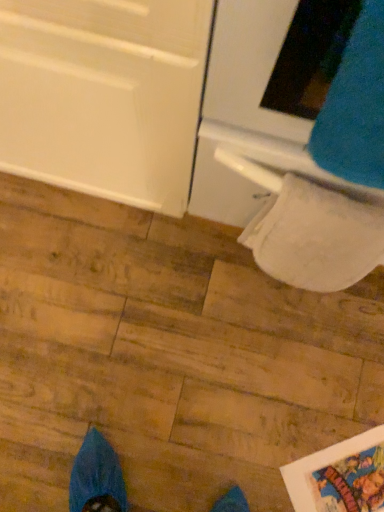
At what (x,y) coordinates should I click in order to perform the action: click on white glossy oven at upper right. Please return your answer as a coordinate pair (x, y). This screenshot has width=384, height=512. Looking at the image, I should click on (295, 151).

The image size is (384, 512). Describe the element at coordinates (315, 237) in the screenshot. I see `white textured toilet paper at lower right` at that location.

You are a GUI agent. You are given a task and a screenshot of the screen. Output one action in this format:
    pyautogui.click(x=<x>, y=<y>)
    Task: Click on the white glossy oven at upper right
    This screenshot has height=512, width=384.
    Given the screenshot: What is the action you would take?
    pyautogui.click(x=295, y=151)

Considering the positions of objects white glossy oven at upper right and blue fuzzy sweat pants at upper right in the image provided, who is in front, white glossy oven at upper right or blue fuzzy sweat pants at upper right?

blue fuzzy sweat pants at upper right.

What's the angular difference between white glossy oven at upper right and blue fuzzy sweat pants at upper right's facing directions?

3.48 degrees.

Which is more to the left, white glossy oven at upper right or blue fuzzy sweat pants at upper right?

Positioned to the left is blue fuzzy sweat pants at upper right.

In the image, is white glossy oven at upper right positioned in front of or behind white textured toilet paper at lower right?

white glossy oven at upper right is positioned closer to the viewer than white textured toilet paper at lower right.

In order to click on toilet paper behind the white glossy oven at upper right in this screenshot , I will do `click(315, 237)`.

Which of these two, white glossy oven at upper right or white textured toilet paper at lower right, is bigger?

white glossy oven at upper right is bigger.

Is white glossy oven at upper right next to white textured toilet paper at lower right and touching it?

Absolutely, white glossy oven at upper right is next to and touching white textured toilet paper at lower right.

The height and width of the screenshot is (512, 384). What are the coordinates of `toilet paper lying below the blue fuzzy sweat pants at upper right (from the image's perspective)` in the screenshot? It's located at (315, 237).

Is blue fuzzy sweat pants at upper right thinner than white textured toilet paper at lower right?

Yes.

From the image's perspective, is blue fuzzy sweat pants at upper right on top of white textured toilet paper at lower right?

Yes.

Consider the image. Is the depth of blue fuzzy sweat pants at upper right greater than that of white textured toilet paper at lower right?

That is False.

Does white textured toilet paper at lower right have a lesser height compared to white glossy oven at upper right?

Yes.

Can you confirm if white textured toilet paper at lower right is bigger than white glossy oven at upper right?

Actually, white textured toilet paper at lower right might be smaller than white glossy oven at upper right.

The image size is (384, 512). What are the coordinates of `toilet paper above the white glossy oven at upper right (from a real-world perspective)` in the screenshot? It's located at (315, 237).

From the picture: From a real-world perspective, is white textured toilet paper at lower right located higher than white glossy oven at upper right?

Yes.

Is blue fuzzy sweat pants at upper right touching white glossy oven at upper right?

No, blue fuzzy sweat pants at upper right is not beside white glossy oven at upper right.

Between point (368, 49) and point (335, 220), which one is positioned in front?

The point (368, 49) is more forward.

From the image's perspective, does blue fuzzy sweat pants at upper right appear higher than white glossy oven at upper right?

Actually, blue fuzzy sweat pants at upper right appears below white glossy oven at upper right in the image.

How many degrees apart are the facing directions of blue fuzzy sweat pants at upper right and white glossy oven at upper right?

3.48 degrees separate the facing orientations of blue fuzzy sweat pants at upper right and white glossy oven at upper right.

Considering the sizes of objects white textured toilet paper at lower right and blue fuzzy sweat pants at upper right in the image provided, who is thinner, white textured toilet paper at lower right or blue fuzzy sweat pants at upper right?

With smaller width is blue fuzzy sweat pants at upper right.

Is white textured toilet paper at lower right not within blue fuzzy sweat pants at upper right?

white textured toilet paper at lower right is positioned outside blue fuzzy sweat pants at upper right.

Are white textured toilet paper at lower right and blue fuzzy sweat pants at upper right far apart?

white textured toilet paper at lower right is near blue fuzzy sweat pants at upper right, not far away.

Relative to blue fuzzy sweat pants at upper right, is white textured toilet paper at lower right in front or behind?

Clearly, white textured toilet paper at lower right is behind blue fuzzy sweat pants at upper right.

I want to click on sweat pant positioned vertically above the white glossy oven at upper right (from a real-world perspective), so click(355, 106).

Where is `oven in front of the white textured toilet paper at lower right`? This screenshot has height=512, width=384. oven in front of the white textured toilet paper at lower right is located at coordinates (295, 151).

Considering their positions, is white textured toilet paper at lower right positioned closer to blue fuzzy sweat pants at upper right than white glossy oven at upper right?

white glossy oven at upper right lies closer to blue fuzzy sweat pants at upper right than the other object.

From the image, which object appears to be nearer to blue fuzzy sweat pants at upper right, white glossy oven at upper right or white textured toilet paper at lower right?

white glossy oven at upper right is closer to blue fuzzy sweat pants at upper right.

Which object lies nearer to the anchor point white textured toilet paper at lower right, blue fuzzy sweat pants at upper right or white glossy oven at upper right?

white glossy oven at upper right.

In the scene shown: From the image, which object appears to be farther from white glossy oven at upper right, white textured toilet paper at lower right or blue fuzzy sweat pants at upper right?

blue fuzzy sweat pants at upper right is positioned further to the anchor white glossy oven at upper right.

When comparing their distances from white glossy oven at upper right, does blue fuzzy sweat pants at upper right or white textured toilet paper at lower right seem further?

blue fuzzy sweat pants at upper right.

Estimate the real-world distances between objects in this image. Which object is further from white textured toilet paper at lower right, white glossy oven at upper right or blue fuzzy sweat pants at upper right?

blue fuzzy sweat pants at upper right.

At what (x,y) coordinates should I click in order to perform the action: click on oven between blue fuzzy sweat pants at upper right and white textured toilet paper at lower right along the z-axis. Please return your answer as a coordinate pair (x, y). The width and height of the screenshot is (384, 512). Looking at the image, I should click on (295, 151).